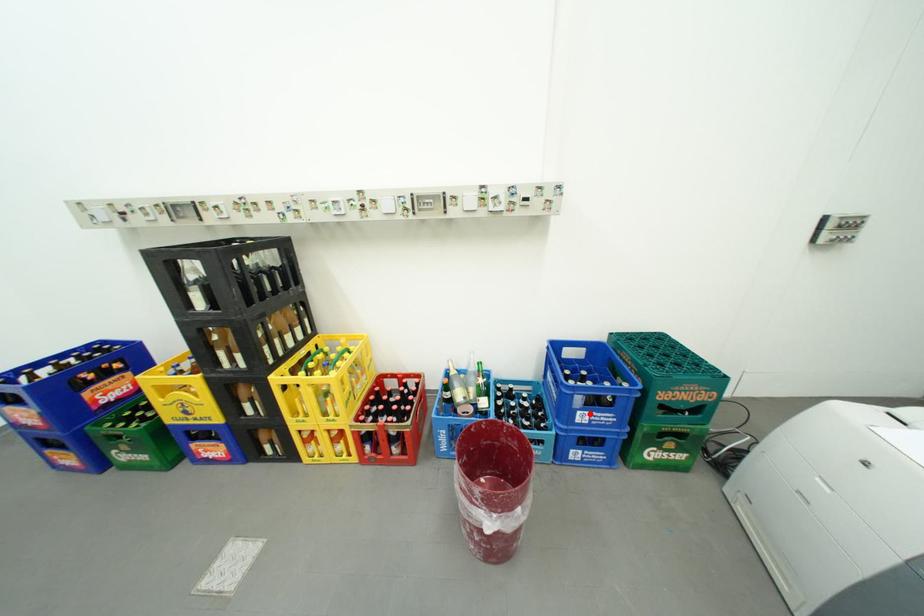
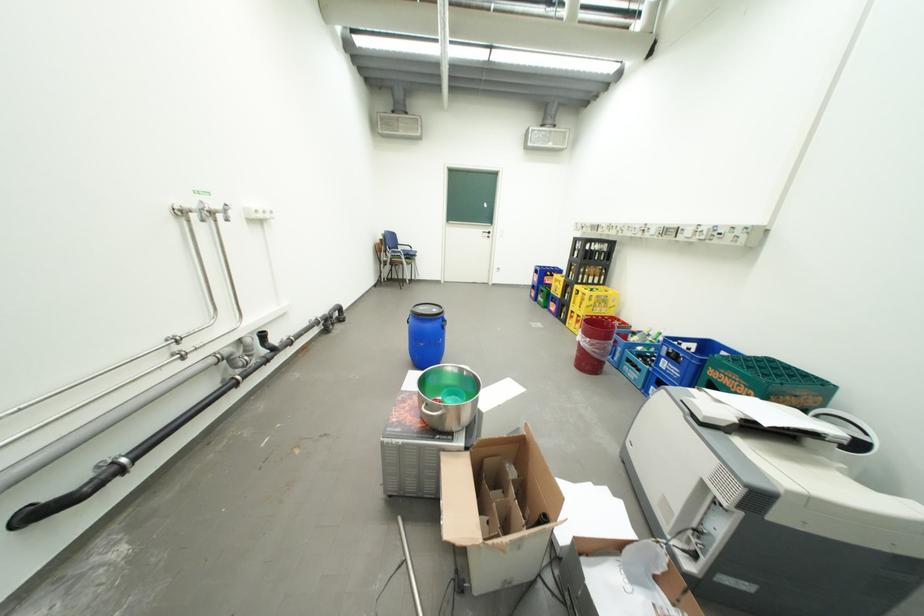
Where in the second image is the point corresponding to the highlighted location from the first image?

(674, 361)